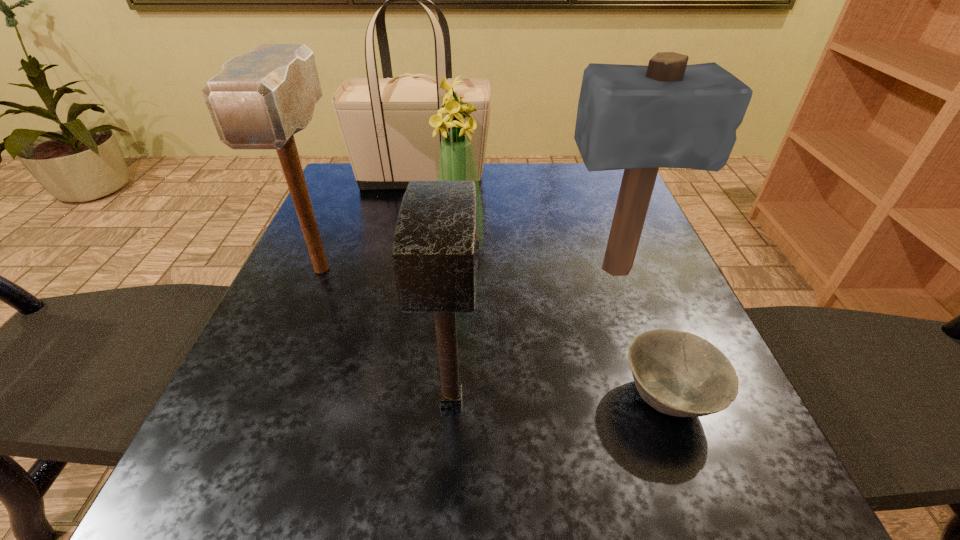
This screenshot has height=540, width=960. I want to click on free spot located on the front-facing side of the bouquet, so click(x=540, y=248).

Locate an element on the screen. This screenshot has height=540, width=960. vacant region located 0.220m on the left of the nearest mallet is located at coordinates (276, 400).

Locate an element on the screen. This screenshot has height=540, width=960. free space located on the left of the bowl is located at coordinates (506, 397).

Where is `object located in the far edge section of the desktop`? The width and height of the screenshot is (960, 540). object located in the far edge section of the desktop is located at coordinates (384, 122).

Identify the location of shopping bag situated at the left edge. (384, 122).

I want to click on mallet that is at the left edge, so click(259, 100).

In order to click on mallet located at the right edge in this screenshot , I will do `click(668, 114)`.

At what (x,y) coordinates should I click in order to perform the action: click on bowl at the right edge. Please return your answer as a coordinate pair (x, y). This screenshot has width=960, height=540. Looking at the image, I should click on (678, 373).

The width and height of the screenshot is (960, 540). What are the coordinates of `object that is positioned at the far left corner` in the screenshot? It's located at (384, 122).

This screenshot has height=540, width=960. I want to click on free space at the far edge, so click(526, 187).